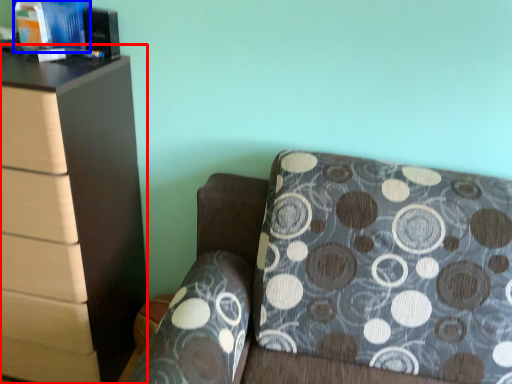
Question: Which object appears closest to the camera in this image, chest of drawers (highlighted by a red box) or book (highlighted by a blue box)?

Choices:
 (A) chest of drawers
 (B) book

Answer: (A)